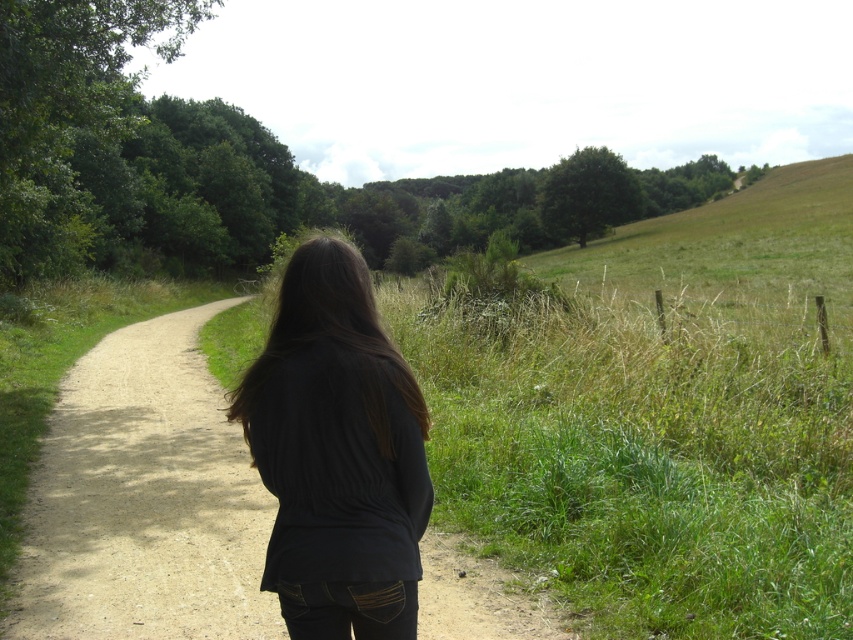
Question: Can you confirm if dirt path at center is wider than black matte shirt at center?

Choices:
 (A) no
 (B) yes

Answer: (B)

Question: Which point is farther to the camera?

Choices:
 (A) black matte shirt at center
 (B) dirt path at center

Answer: (B)

Question: Is dirt path at center further to the viewer compared to black matte shirt at center?

Choices:
 (A) no
 (B) yes

Answer: (B)

Question: Can you confirm if dirt path at center is positioned to the right of black matte shirt at center?

Choices:
 (A) yes
 (B) no

Answer: (B)